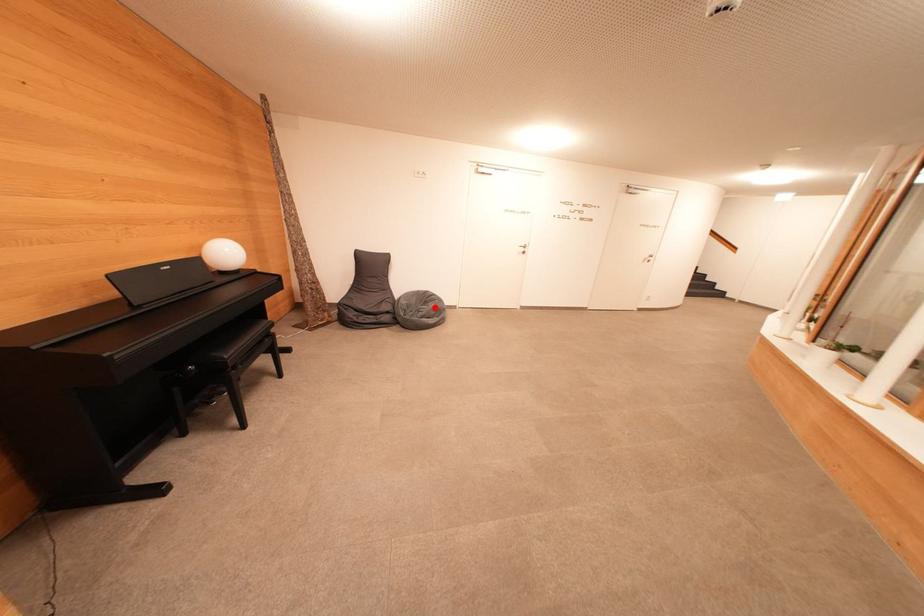
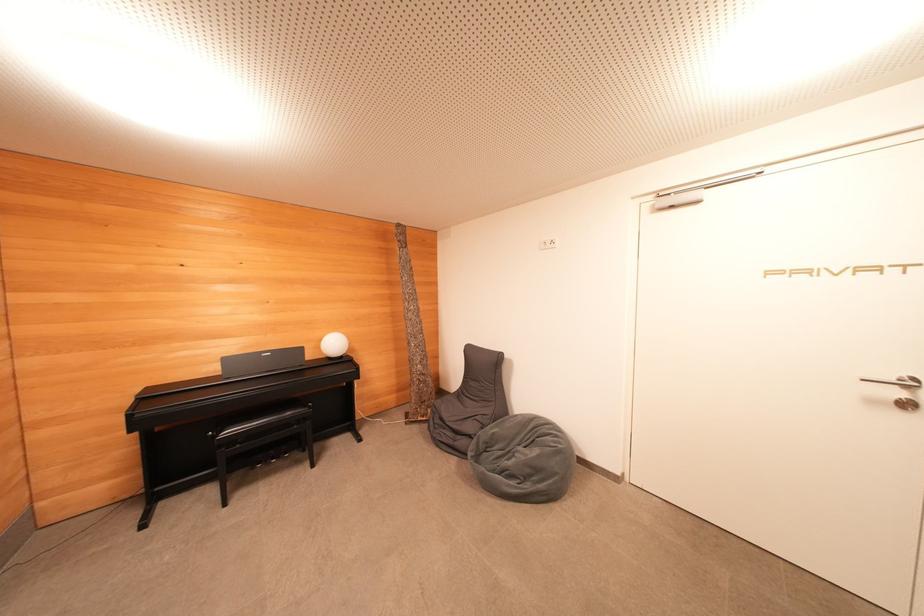
Question: I am providing you with two images of the same scene from different viewpoints. Image1 has a red point marked. In image2, the corresponding 3D location appears at what relative position? Reply with the corresponding letter.

Choices:
 (A) Closer
 (B) Farther

Answer: (B)